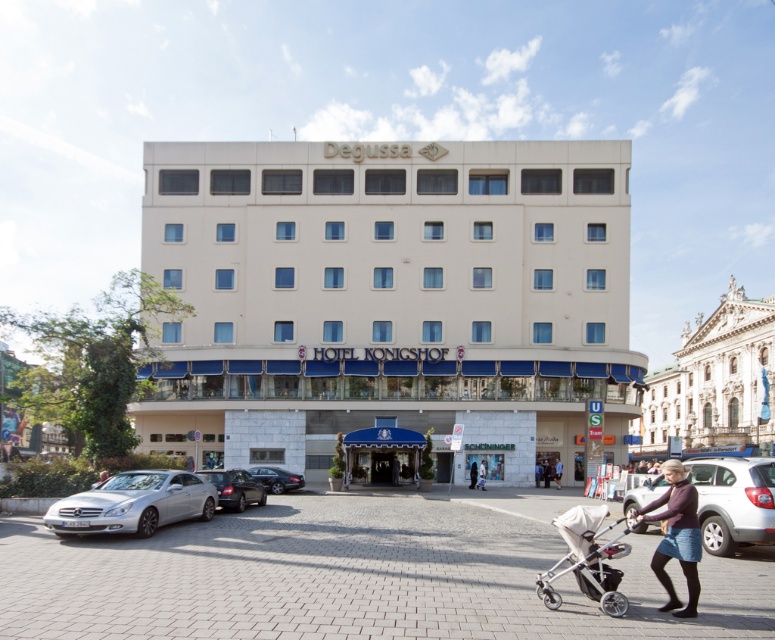
You are standing in front of the Hotel Koenigshof and want to take a photo of the building. You notice two points marked as point 1 at coordinates (x=715, y=480) and point 2 at coordinates (x=259, y=477). Which point would appear closer to you in the photo?

Point 1 at coordinates (x=715, y=480) would appear closer to you in the photo because it is closer to the camera than point 2 at coordinates (x=259, y=477).

You are a visitor approaching the Hotel Koenigshof entrance. You see a silver metallic stroller at lower right and dark blue jeans at center. Which object is closer to the hotel entrance?

The silver metallic stroller at lower right is closer to the hotel entrance because it is located above the dark blue jeans at center, which is further away from the entrance.

You are a delivery person trying to park your van in the parking lot in front of the white marble building at upper right. The parking spot you want to use is currently occupied by the silver metallic stroller at lower right. Can you fit your van in the parking spot if the stroller is moved?

The white marble building at upper right is larger than the silver metallic stroller at lower right. However, the size comparison between the building and the stroller does not provide information about the parking spot dimensions. Therefore, it is unclear if the van can fit in the parking spot after moving the stroller.